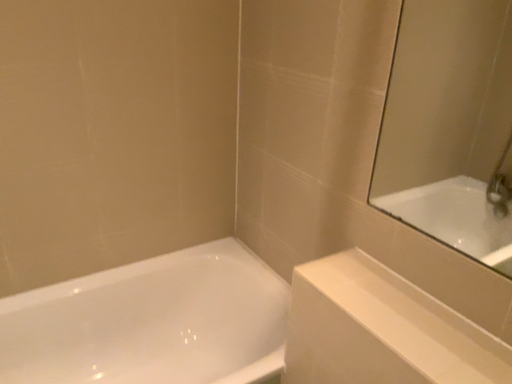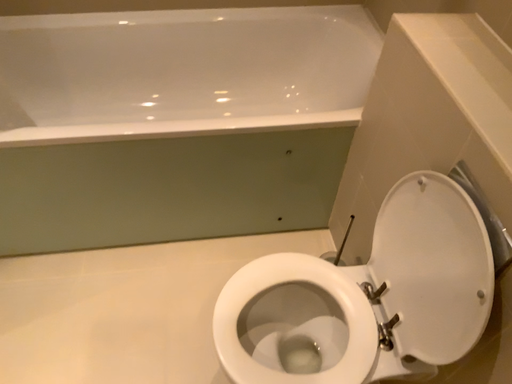
Question: How did the camera likely rotate when shooting the video?

Choices:
 (A) rotated right
 (B) rotated left

Answer: (B)